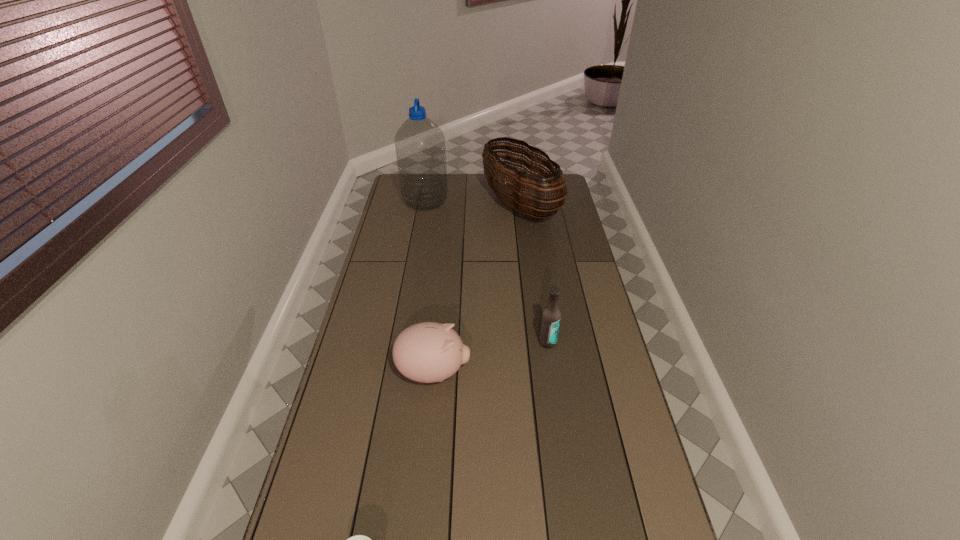
The image size is (960, 540). I want to click on the tallest object, so click(420, 148).

Identify the location of basket. This screenshot has width=960, height=540. (523, 199).

Identify the location of beer bottle. This screenshot has width=960, height=540. (551, 315).

What are the coordinates of `the second nearest object` in the screenshot? It's located at coord(427,352).

Where is `piggy bank`? piggy bank is located at coordinates (427, 352).

Locate an element on the screen. This screenshot has width=960, height=540. vacant space situated on the right of the water jug is located at coordinates (528, 201).

Find the location of a particular element. This screenshot has height=540, width=960. free region located 0.100m on the left of the basket is located at coordinates (462, 205).

Where is `free space located on the side of the third nearest object with the label`? The image size is (960, 540). free space located on the side of the third nearest object with the label is located at coordinates (564, 453).

The height and width of the screenshot is (540, 960). Identify the location of blank space located 0.390m at the snout of the fourth farthest object. (591, 373).

I want to click on water jug present at the far edge, so click(420, 148).